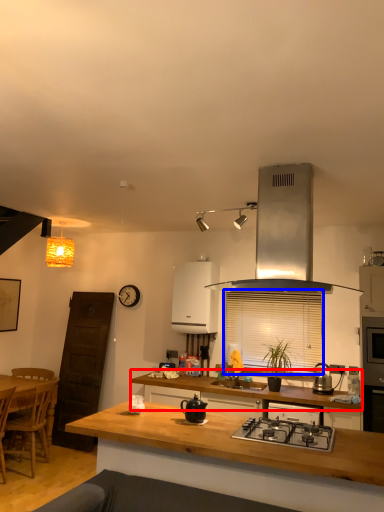
Question: Which object is further to the camera taking this photo, cabinetry (highlighted by a red box) or window screen (highlighted by a blue box)?

Choices:
 (A) cabinetry
 (B) window screen

Answer: (B)